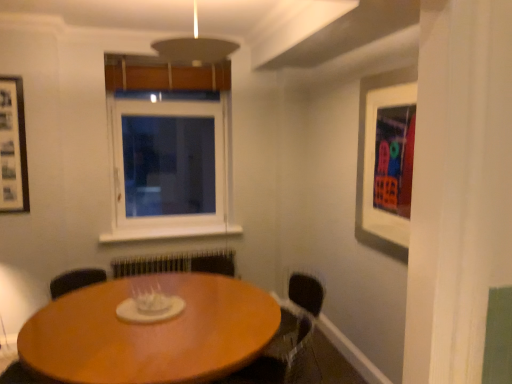
In order to face matte black armchair at lower right, should I rotate leftwards or rightwards?

To face it directly, rotate right by 4.136 degrees.

The height and width of the screenshot is (384, 512). I want to click on white matte picture frame at upper right, placed as the 1th picture frame when sorted from right to left, so click(377, 158).

The width and height of the screenshot is (512, 384). What do you see at coordinates (377, 158) in the screenshot?
I see `white matte picture frame at upper right, which appears as the 2th picture frame when viewed from the left` at bounding box center [377, 158].

Find the location of a particular element. The image size is (512, 384). wooden table at center is located at coordinates (150, 332).

Does black matte picture frame at left, positioned as the first picture frame in left-to-right order, have a lesser height compared to white plastic window at center?

Yes.

Considering the relative positions of black matte picture frame at left, which is counted as the 2th picture frame, starting from the front, and white plastic window at center in the image provided, is black matte picture frame at left, which is counted as the 2th picture frame, starting from the front, to the left of white plastic window at center from the viewer's perspective?

Yes, black matte picture frame at left, which is counted as the 2th picture frame, starting from the front, is to the left of white plastic window at center.

Which object is thinner, black matte picture frame at left, placed as the 2th picture frame when sorted from right to left, or white plastic window at center?

black matte picture frame at left, placed as the 2th picture frame when sorted from right to left.

Are black matte picture frame at left, which is the first picture frame from back to front, and white plastic window at center beside each other?

No, black matte picture frame at left, which is the first picture frame from back to front, is not next to white plastic window at center.

Find the location of a particular element. The height and width of the screenshot is (384, 512). the 2nd picture frame above the matte black armchair at lower right (from the image's perspective) is located at coordinates (13, 148).

In the scene shown: How different are the orientations of matte black armchair at lower right and black matte picture frame at left, which is the first picture frame from back to front, in degrees?

69.7 degrees.

Measure the distance from matte black armchair at lower right to black matte picture frame at left, which is counted as the 2th picture frame, starting from the front.

The distance of matte black armchair at lower right from black matte picture frame at left, which is counted as the 2th picture frame, starting from the front, is 7.84 feet.

Considering the sizes of objects matte black armchair at lower right and black matte picture frame at left, placed as the 2th picture frame when sorted from right to left, in the image provided, who is smaller, matte black armchair at lower right or black matte picture frame at left, placed as the 2th picture frame when sorted from right to left,?

black matte picture frame at left, placed as the 2th picture frame when sorted from right to left, is smaller.

Is wooden table at center positioned far away from black matte picture frame at left, which is counted as the 2th picture frame, starting from the front?

Yes, wooden table at center and black matte picture frame at left, which is counted as the 2th picture frame, starting from the front, are quite far apart.

Is wooden table at center inside or outside of black matte picture frame at left, positioned as the first picture frame in left-to-right order?

wooden table at center lies outside black matte picture frame at left, positioned as the first picture frame in left-to-right order.

From a real-world perspective, is wooden table at center located beneath black matte picture frame at left, positioned as the first picture frame in left-to-right order?

Yes, from a real-world perspective, wooden table at center is beneath black matte picture frame at left, positioned as the first picture frame in left-to-right order.

How different are the orientations of wooden table at center and black matte picture frame at left, positioned as the first picture frame in left-to-right order, in degrees?

The facing directions of wooden table at center and black matte picture frame at left, positioned as the first picture frame in left-to-right order, are 85.8 degrees apart.

Looking at this image, are white plastic window at center and white matte picture frame at upper right, which is the 1th picture frame in front-to-back order, beside each other?

No, white plastic window at center is not in contact with white matte picture frame at upper right, which is the 1th picture frame in front-to-back order.

Consider the image. Which object is wider, white plastic window at center or white matte picture frame at upper right, marked as the second picture frame in a back-to-front arrangement?

white plastic window at center.

Is white plastic window at center aimed at white matte picture frame at upper right, which appears as the 2th picture frame when viewed from the left?

No, white plastic window at center is not turned towards white matte picture frame at upper right, which appears as the 2th picture frame when viewed from the left.

Can white matte picture frame at upper right, placed as the 1th picture frame when sorted from right to left, be found inside white plastic window at center?

No, white matte picture frame at upper right, placed as the 1th picture frame when sorted from right to left, is not surrounded by white plastic window at center.

Does point (282, 344) come closer to viewer compared to point (153, 343)?

That is False.

How far apart are matte black armchair at lower right and wooden table at center?

matte black armchair at lower right is 1.16 meters away from wooden table at center.

Looking at this image, who is smaller, matte black armchair at lower right or wooden table at center?

Smaller between the two is matte black armchair at lower right.

Which object is positioned more to the left, matte black armchair at lower right or wooden table at center?

From the viewer's perspective, wooden table at center appears more on the left side.

From the picture: Is wooden table at center to the right of matte black armchair at lower right from the viewer's perspective?

No, wooden table at center is not to the right of matte black armchair at lower right.

Based on the photo, considering the sizes of wooden table at center and matte black armchair at lower right in the image, is wooden table at center wider or thinner than matte black armchair at lower right?

In the image, wooden table at center appears to be wider than matte black armchair at lower right.

Considering their positions, is wooden table at center located in front of or behind matte black armchair at lower right?

wooden table at center is in front of matte black armchair at lower right.

What are the coordinates of `table below the matte black armchair at lower right (from a real-world perspective)` in the screenshot? It's located at (150, 332).

Where is `the 1st picture frame above the wooden table at center (from a real-world perspective)`? the 1st picture frame above the wooden table at center (from a real-world perspective) is located at coordinates (377, 158).

Is white matte picture frame at upper right, which is the 1th picture frame in front-to-back order, far away from wooden table at center?

white matte picture frame at upper right, which is the 1th picture frame in front-to-back order, is far away from wooden table at center.

Which is farther, (395, 103) or (253, 315)?

Point (395, 103)

Is white matte picture frame at upper right, placed as the 1th picture frame when sorted from right to left, aimed at wooden table at center?

Yes, white matte picture frame at upper right, placed as the 1th picture frame when sorted from right to left, faces towards wooden table at center.

Where is `window to the right of black matte picture frame at left, positioned as the first picture frame in left-to-right order`? Image resolution: width=512 pixels, height=384 pixels. window to the right of black matte picture frame at left, positioned as the first picture frame in left-to-right order is located at coordinates (168, 150).

The image size is (512, 384). What are the coordinates of `picture frame on the left of matte black armchair at lower right` in the screenshot? It's located at (13, 148).

Based on their spatial positions, is white plastic window at center or wooden table at center further from white matte picture frame at upper right, marked as the second picture frame in a back-to-front arrangement?

Based on the image, white plastic window at center appears to be further to white matte picture frame at upper right, marked as the second picture frame in a back-to-front arrangement.

From the image, which object appears to be farther from wooden table at center, matte black armchair at lower right or black matte picture frame at left, placed as the 2th picture frame when sorted from right to left?

black matte picture frame at left, placed as the 2th picture frame when sorted from right to left, lies further to wooden table at center than the other object.

In the scene shown: When comparing their distances from white plastic window at center, does black matte picture frame at left, placed as the 2th picture frame when sorted from right to left, or white matte picture frame at upper right, which is the 1th picture frame in front-to-back order, seem further?

Based on the image, white matte picture frame at upper right, which is the 1th picture frame in front-to-back order, appears to be further to white plastic window at center.

Based on their spatial positions, is black matte picture frame at left, placed as the 2th picture frame when sorted from right to left, or wooden table at center further from matte black armchair at lower right?

black matte picture frame at left, placed as the 2th picture frame when sorted from right to left, lies further to matte black armchair at lower right than the other object.

Looking at the image, which one is located closer to white matte picture frame at upper right, which is the 1th picture frame in front-to-back order, wooden table at center or white plastic window at center?

wooden table at center is closer to white matte picture frame at upper right, which is the 1th picture frame in front-to-back order.

Considering their positions, is wooden table at center positioned further to matte black armchair at lower right than black matte picture frame at left, which is counted as the 2th picture frame, starting from the front?

Among the two, black matte picture frame at left, which is counted as the 2th picture frame, starting from the front, is located further to matte black armchair at lower right.

When comparing their distances from white plastic window at center, does matte black armchair at lower right or wooden table at center seem further?

Based on the image, matte black armchair at lower right appears to be further to white plastic window at center.

Looking at the image, which one is located closer to wooden table at center, matte black armchair at lower right or white plastic window at center?

Based on the image, matte black armchair at lower right appears to be nearer to wooden table at center.

Where is `window between black matte picture frame at left, positioned as the first picture frame in left-to-right order, and matte black armchair at lower right, in the horizontal direction`? window between black matte picture frame at left, positioned as the first picture frame in left-to-right order, and matte black armchair at lower right, in the horizontal direction is located at coordinates (168, 150).

Image resolution: width=512 pixels, height=384 pixels. I want to click on window located between black matte picture frame at left, which is counted as the 2th picture frame, starting from the front, and white matte picture frame at upper right, which is the 1th picture frame in front-to-back order, in the left-right direction, so click(168, 150).

Locate an element on the screen. This screenshot has width=512, height=384. table between black matte picture frame at left, which is counted as the 2th picture frame, starting from the front, and matte black armchair at lower right from left to right is located at coordinates tap(150, 332).

You are a GUI agent. You are given a task and a screenshot of the screen. Output one action in this format:
    pyautogui.click(x=<x>, y=<y>)
    Task: Click on the armchair situated between wooden table at center and white matte picture frame at upper right, placed as the 1th picture frame when sorted from right to left, from left to right
    
    Given the screenshot: What is the action you would take?
    pyautogui.click(x=293, y=328)